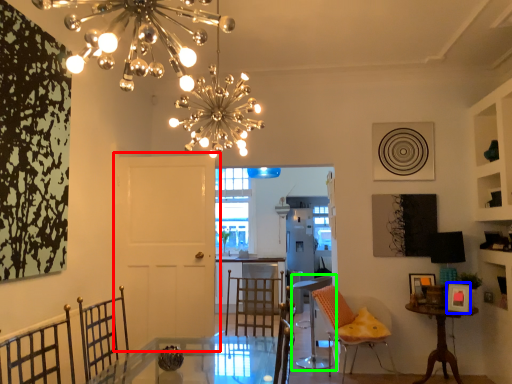
Question: Which object is positioned farthest from door (highlighted by a red box)? Select from picture frame (highlighted by a blue box) and chair (highlighted by a green box).

Choices:
 (A) picture frame
 (B) chair

Answer: (A)